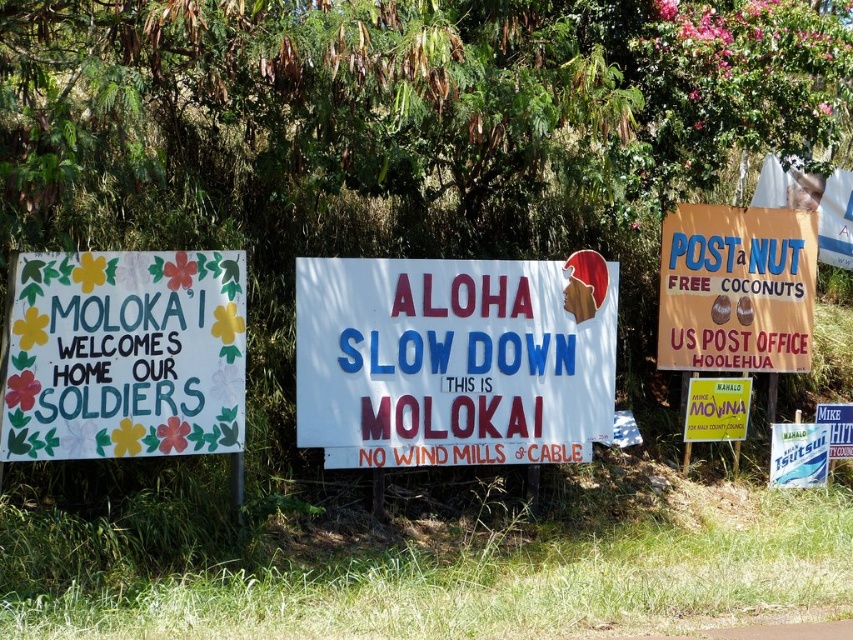
You are a tourist standing in front of the signs. You want to take a photo that includes both the blue cardboard sign at right and the white plastic sign at lower right. Which sign should you focus on to ensure both are in the frame?

The blue cardboard sign at right is bigger than the white plastic sign at lower right, so focusing on the blue cardboard sign at right will help ensure both signs are in the frame.

You are a visitor standing at the edge of the grassy area where the signs are placed. You notice two signs at the center of the scene. Which sign, the white paper sign at center or the yellow paper sign at center, is taller?

The white paper sign at center is much taller than the yellow paper sign at center.

You are a tourist driving along the road and see the blue cardboard sign at right and the yellow paper sign at center. Which sign is bigger?

The blue cardboard sign at right is larger in size than the yellow paper sign at center.